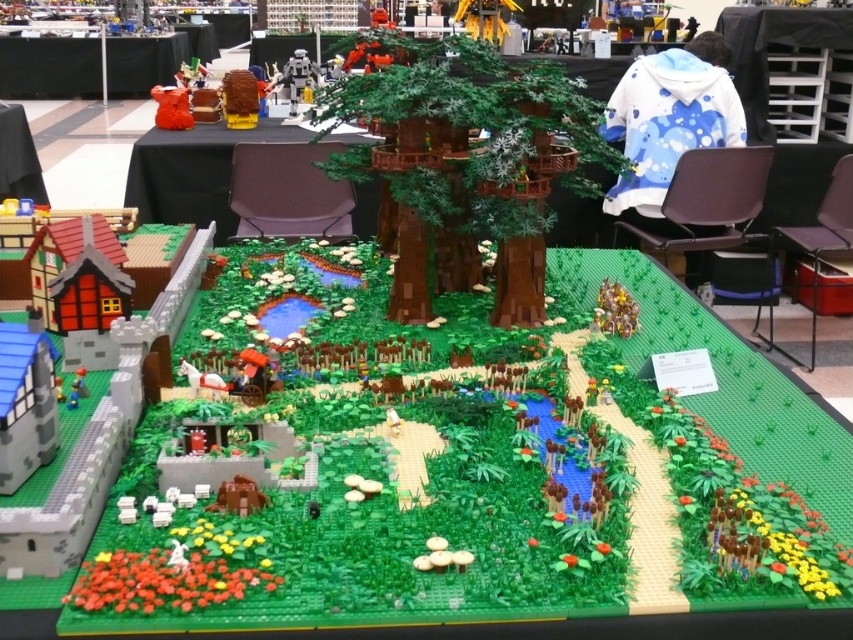
You are a LEGO enthusiast attending a convention and standing 6 feet away from the edge of the green matte table at center. Can you comfortably view the entire LEGO diorama without moving your head?

The green matte table at center is 8.94 feet away from the camera. Since you are standing 6 feet away from its edge, the total distance from you to the far end of the table would be 6 feet plus the table length. However, the table length isn not provided. Without knowing the table length, it is impossible to determine if you can view the entire diorama without moving your head.

You are setting up a display at a convention and need to place a small figurine on the table that is closer to the ground. Which table should you choose between the green matte table at center and the black plastic table at upper left?

The green matte table at center is not as tall as the black plastic table at upper left, so you should choose the green matte table at center because it is closer to the ground.

You are a guest at the LEGO convention and want to take a photo of the green matte table at center and the black plastic table at upper left. Which table should you focus on first to ensure both are in the frame without moving your camera?

You should focus on the green matte table at center first because it is closer to the viewer than the black plastic table at upper left, so adjusting the focus to the closer object will help both be in the frame.